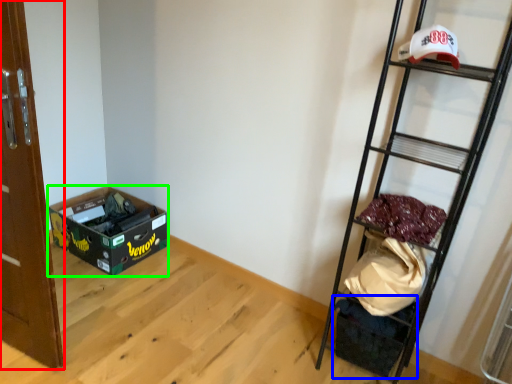
Question: Considering the real-world distances, which object is farthest from door (highlighted by a red box)? storage box (highlighted by a blue box) or box (highlighted by a green box)?

Choices:
 (A) storage box
 (B) box

Answer: (A)